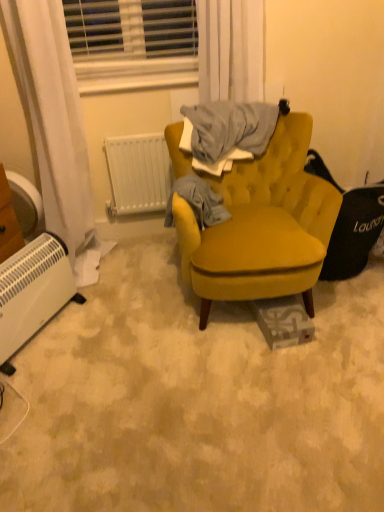
Question: Does white plastic blinds at upper center appear on the left side of white plastic radiator at lower left, positioned as the 1th radiator in left-to-right order?

Choices:
 (A) yes
 (B) no

Answer: (B)

Question: Is white plastic blinds at upper center facing away from white plastic radiator at lower left, which appears as the 2th radiator when viewed from the right?

Choices:
 (A) no
 (B) yes

Answer: (A)

Question: Is white plastic radiator at lower left, the first radiator positioned from the front, completely or partially inside white plastic blinds at upper center?

Choices:
 (A) yes
 (B) no

Answer: (B)

Question: Is white plastic blinds at upper center positioned before white plastic radiator at lower left, positioned as the 1th radiator in left-to-right order?

Choices:
 (A) yes
 (B) no

Answer: (B)

Question: From a real-world perspective, does white plastic blinds at upper center stand above white plastic radiator at lower left, marked as the first radiator in a bottom-to-top arrangement?

Choices:
 (A) no
 (B) yes

Answer: (B)

Question: From a real-world perspective, is white plastic radiator at center, placed as the second radiator when sorted from left to right, positioned above or below gray cotton sweater at center?

Choices:
 (A) above
 (B) below

Answer: (B)

Question: Is white plastic radiator at center, placed as the second radiator when sorted from left to right, in front of or behind gray cotton sweater at center in the image?

Choices:
 (A) behind
 (B) front

Answer: (A)

Question: Is white plastic radiator at center, placed as the second radiator when sorted from left to right, taller or shorter than gray cotton sweater at center?

Choices:
 (A) tall
 (B) short

Answer: (A)

Question: Is point (122, 203) positioned closer to the camera than point (185, 181)?

Choices:
 (A) farther
 (B) closer

Answer: (A)

Question: Is point tap(196, 3) positioned closer to the camera than point tap(362, 245)?

Choices:
 (A) closer
 (B) farther

Answer: (A)

Question: Visually, is white sheer curtain at upper center positioned to the left or to the right of velvet mustard swivel chair at right?

Choices:
 (A) right
 (B) left

Answer: (B)

Question: Is white sheer curtain at upper center in front of or behind velvet mustard swivel chair at right in the image?

Choices:
 (A) behind
 (B) front

Answer: (A)

Question: From a real-world perspective, is white sheer curtain at upper center physically located above or below velvet mustard swivel chair at right?

Choices:
 (A) above
 (B) below

Answer: (A)

Question: Is gray cotton sweater at center wider or thinner than white plastic blinds at upper center?

Choices:
 (A) thin
 (B) wide

Answer: (A)

Question: From the image's perspective, is gray cotton sweater at center located above or below white plastic blinds at upper center?

Choices:
 (A) below
 (B) above

Answer: (A)